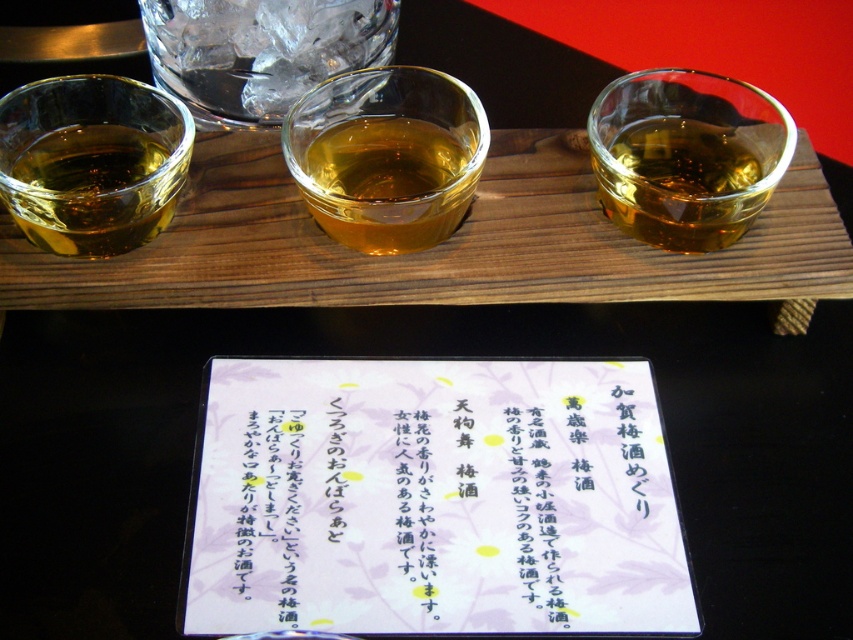
You are a bartender who needs to place a 7.5 inch long cocktail shaker on the tray. The white paper at center and translucent glass at upper center are the only items on the tray. Can you fit the shaker between them without moving any existing items?

The white paper at center and translucent glass at upper center are 7.09 inches apart. Since the cocktail shaker is 7.5 inches long, which is longer than the available space between them, it cannot be placed there without moving existing items.

You are arranging a Japanese tea ceremony and need to place the white paper at center and the translucent glass at upper center on a narrow shelf. The shelf is only wide enough for one of them. Based on their widths, which item should you place on the shelf first to ensure it fits?

The white paper at center has a greater width than the translucent glass at upper center. Therefore, you should place the translucent glass at upper center first since it is narrower and more likely to fit on the narrow shelf.